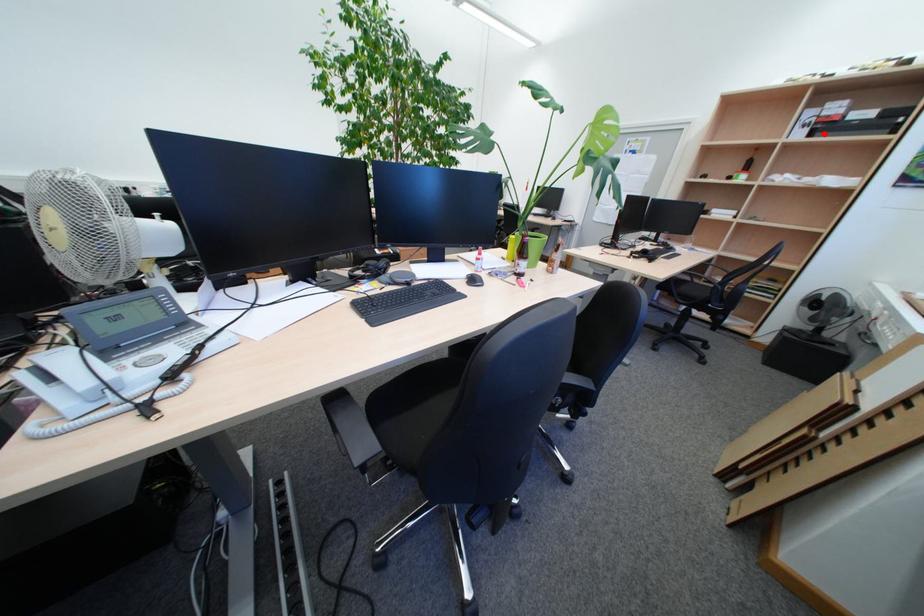
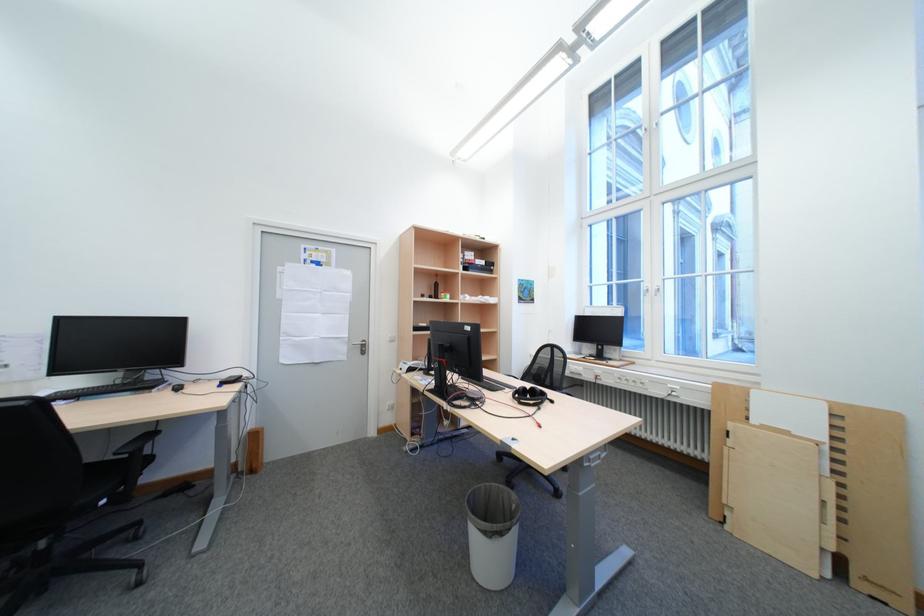
Question: A red point is marked in image1. In image2, is the corresponding 3D point closer to the camera or farther? Reply with the corresponding letter.

Choices:
 (A) The corresponding 3D point is closer.
 (B) The corresponding 3D point is farther.

Answer: (A)